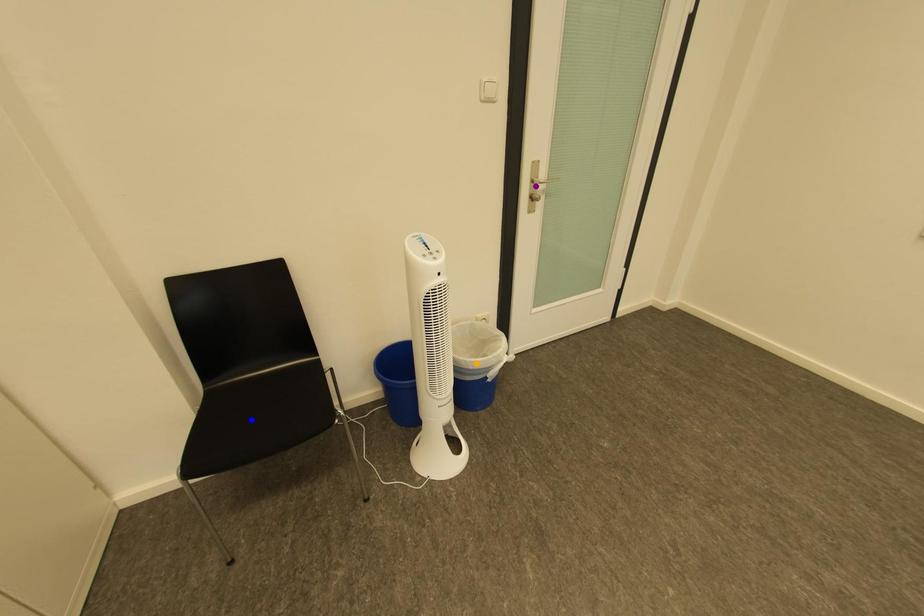
Order these from nearest to farthest:
- blue point
- purple point
- orange point

blue point < orange point < purple point